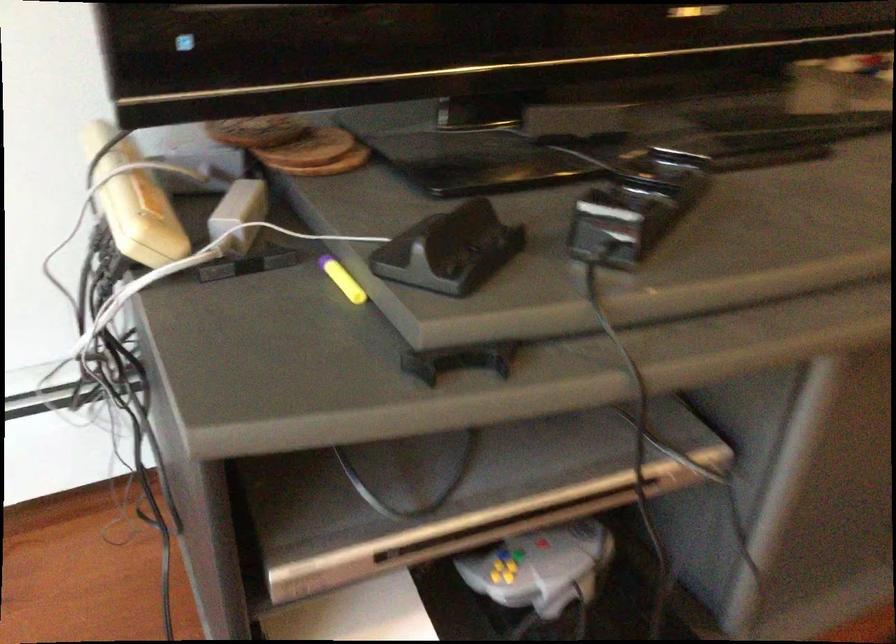
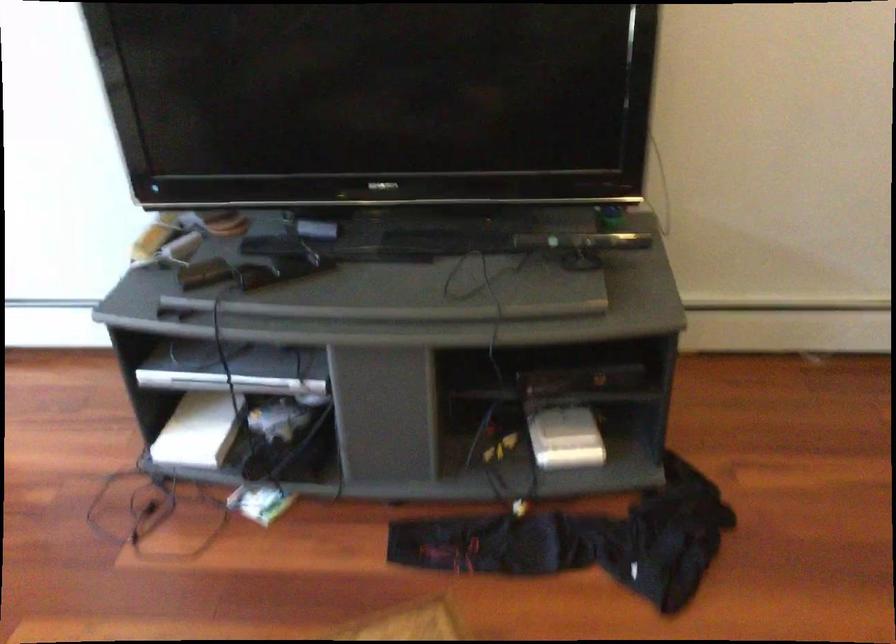
Locate, in the second image, the point that corresponds to the point at 478,234 in the first image.

(203, 272)